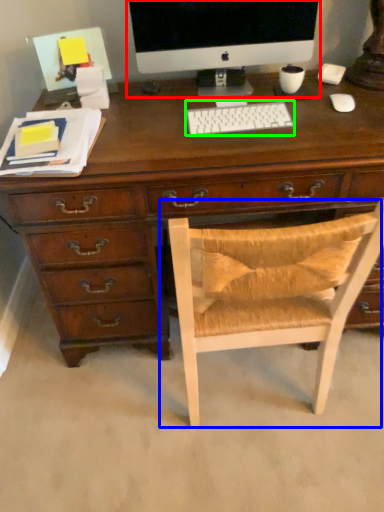
Question: Considering the real-world distances, which object is closest to computer monitor (highlighted by a red box)? chair (highlighted by a blue box) or computer keyboard (highlighted by a green box).

Choices:
 (A) chair
 (B) computer keyboard

Answer: (B)